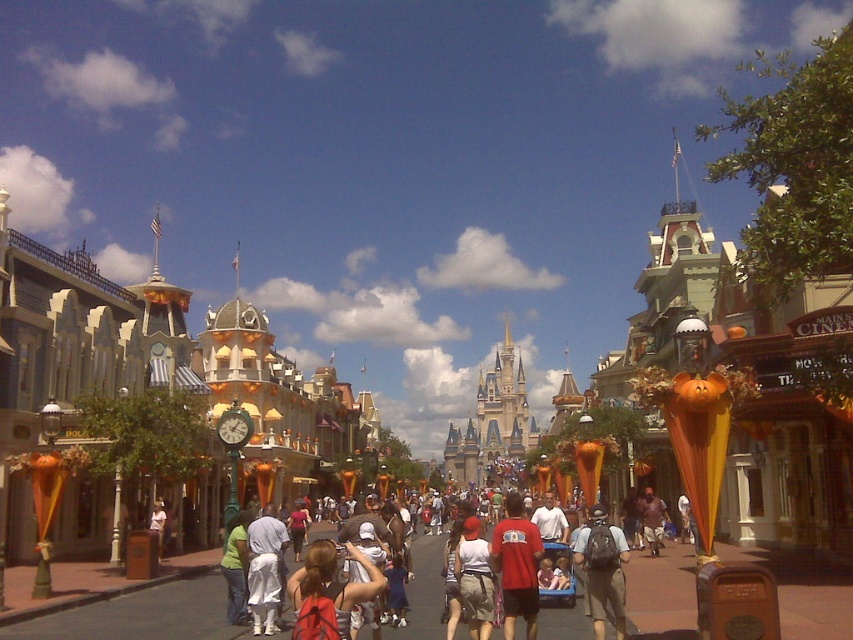
Question: Does red t-shirt at center have a smaller size compared to gray fabric backpack at center?

Choices:
 (A) yes
 (B) no

Answer: (B)

Question: Which object is closer to the camera taking this photo?

Choices:
 (A) gray fabric backpack at center
 (B) red shirt at center
 (C) red t-shirt at center

Answer: (A)

Question: Estimate the real-world distances between objects in this image. Which object is closer to the red shirt at center?

Choices:
 (A) gray fabric backpack at center
 (B) red t-shirt at center

Answer: (A)

Question: Is red t-shirt at center smaller than gray fabric backpack at center?

Choices:
 (A) no
 (B) yes

Answer: (A)

Question: Among these objects, which one is nearest to the camera?

Choices:
 (A) red t-shirt at center
 (B) gray fabric backpack at center

Answer: (B)

Question: Can you confirm if red shirt at center is bigger than gray fabric backpack at center?

Choices:
 (A) no
 (B) yes

Answer: (B)